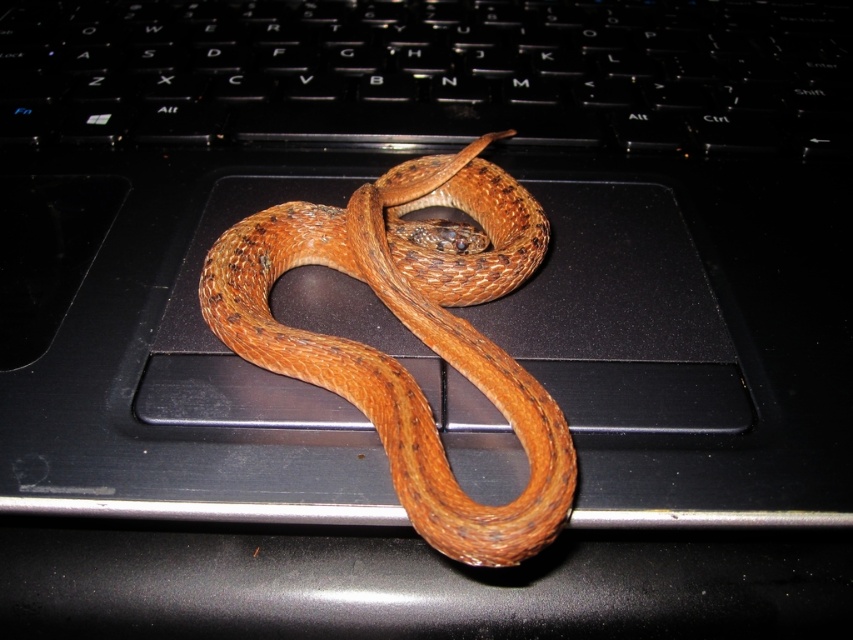
Question: Which point is closer to the camera?

Choices:
 (A) (691, 17)
 (B) (466, 536)

Answer: (B)

Question: Is black plastic keyboard at center to the right of brown scaly snake at center from the viewer's perspective?

Choices:
 (A) no
 (B) yes

Answer: (A)

Question: Where is black plastic keyboard at center located in relation to brown scaly snake at center in the image?

Choices:
 (A) above
 (B) below

Answer: (A)

Question: Which point is farther to the camera?

Choices:
 (A) tap(18, 116)
 (B) tap(334, 355)

Answer: (A)

Question: Can you confirm if black plastic keyboard at center is thinner than brown scaly snake at center?

Choices:
 (A) yes
 (B) no

Answer: (B)

Question: Among these objects, which one is nearest to the camera?

Choices:
 (A) brown scaly snake at center
 (B) black plastic keyboard at center

Answer: (A)